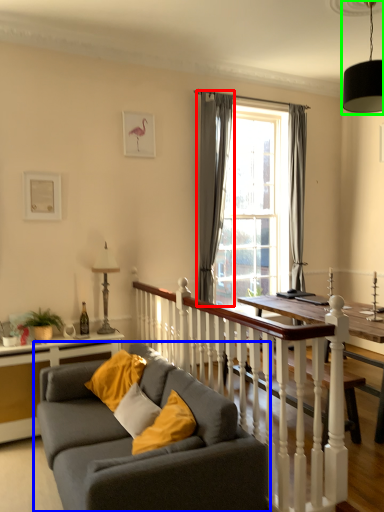
Question: Which object is the farthest from curtain (highlighted by a red box)? Choose among these: studio couch (highlighted by a blue box) or light fixture (highlighted by a green box).

Choices:
 (A) studio couch
 (B) light fixture

Answer: (A)